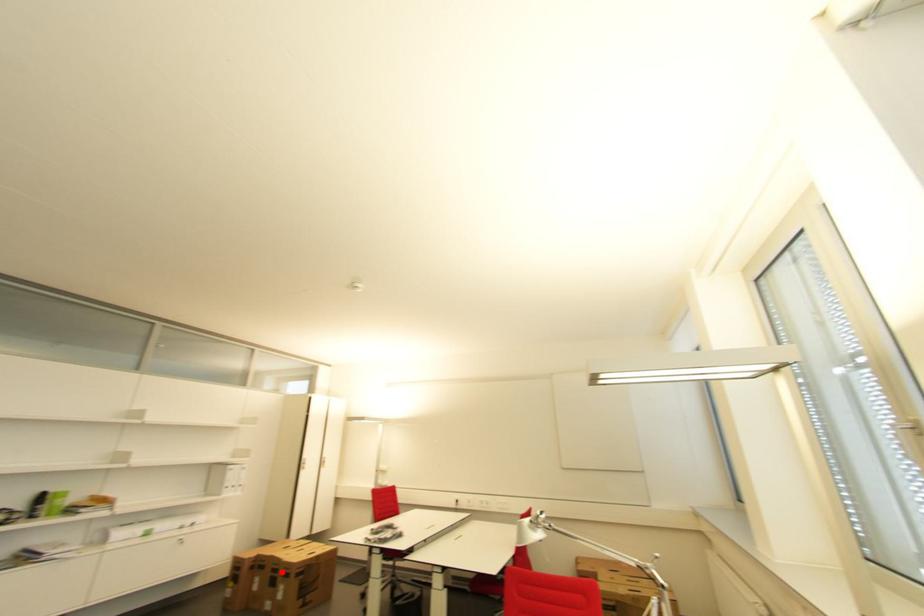
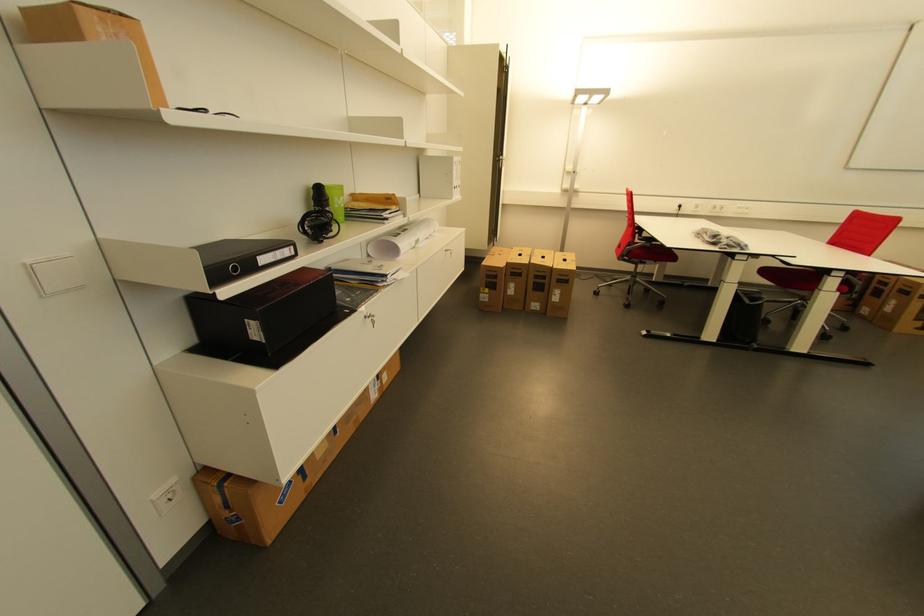
The point at the highlighted location is marked in the first image. Where is the corresponding point in the second image?

(550, 278)